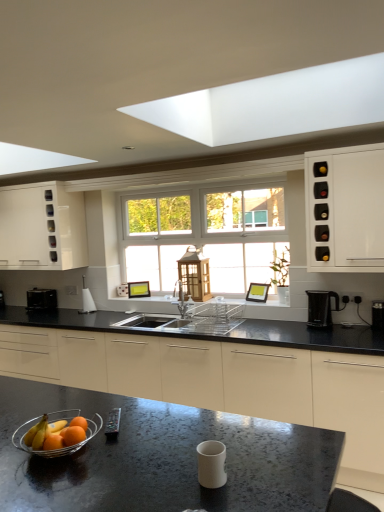
Locate an element on the screen. vacant area on the back side of white matte cup at center, the first appliance when ordered from front to back is located at coordinates (222, 442).